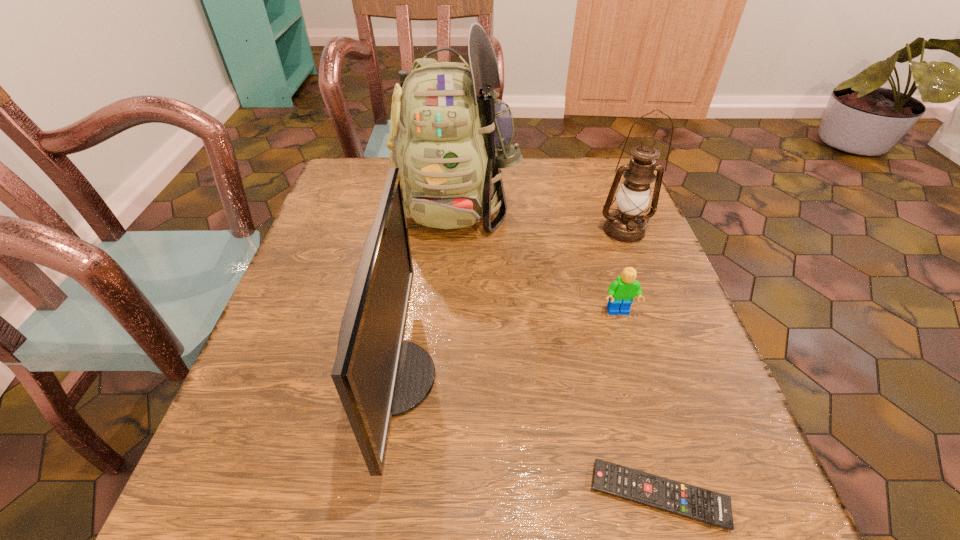
The height and width of the screenshot is (540, 960). Identify the location of vacant region at the near edge of the desktop. (535, 519).

The width and height of the screenshot is (960, 540). I want to click on free space at the left edge of the desktop, so click(x=251, y=363).

This screenshot has width=960, height=540. Find the location of `vacant space at the right edge`. vacant space at the right edge is located at coordinates (620, 275).

You are a GUI agent. You are given a task and a screenshot of the screen. Output one action in this format:
    pyautogui.click(x=<x>, y=<y>)
    Task: Click on the free spot at the far left corner of the desktop
    The image size is (960, 540).
    Given the screenshot: What is the action you would take?
    pyautogui.click(x=347, y=191)

Where is `free space at the near left corner of the desktop`? free space at the near left corner of the desktop is located at coordinates (204, 489).

Locate an element on the screen. The width and height of the screenshot is (960, 540). free space that is in between the monitor and the second shortest object is located at coordinates (505, 345).

Where is `free spot between the Lego and the backpack`? Image resolution: width=960 pixels, height=540 pixels. free spot between the Lego and the backpack is located at coordinates (537, 256).

Find the location of a particular element. The width and height of the screenshot is (960, 540). free area in between the backpack and the monitor is located at coordinates (423, 289).

In order to click on free point between the second shortest object and the shortest object in this screenshot , I will do `click(638, 404)`.

Where is `vacant area between the backpack and the monitor`? Image resolution: width=960 pixels, height=540 pixels. vacant area between the backpack and the monitor is located at coordinates (423, 289).